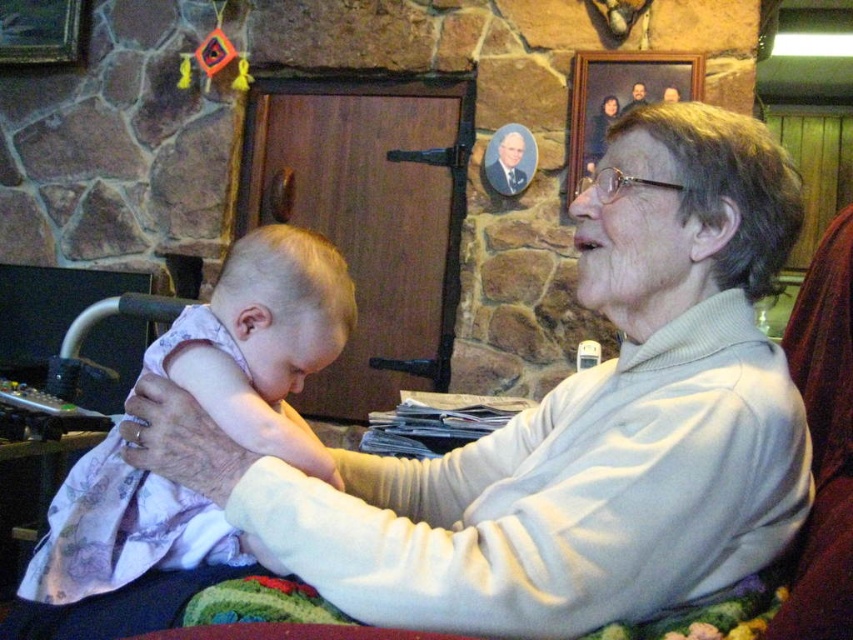
From the picture: You are a photographer setting up for a family portrait. You need to ensure that the white sweater at center and the light pink fabric at center are clearly visible in the photo. Given that the camera has a minimum focus distance of 8 inches, will both objects be in focus?

The white sweater at center is 8.13 inches from light pink fabric at center. Since the distance between them is just over 8 inches, the camera can focus on both objects as they are within the minimum focus distance requirement.

You are taking a photo of the elderly woman and the baby. You notice two points in the image labeled as point 1 at (720, 524) and point 2 at (115, 513). Which point is closer to the camera?

Point 1 at (720, 524) is closer to the camera than point 2 at (115, 513).

You are standing in the living room and want to place a small gift box on the white sweater at center. According to the coordinates provided, where exactly should you place the gift box?

The white sweater at center is located at coordinates point (x=572, y=424), so you should place the gift box there.